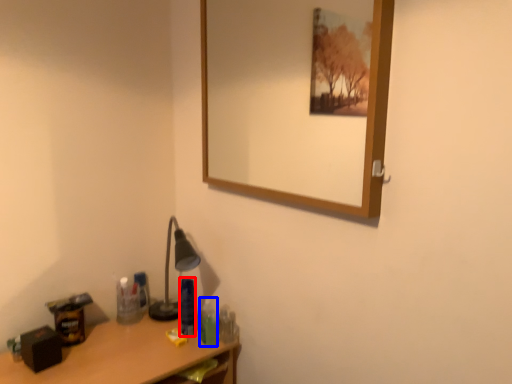
Question: Which point is closer to the camera, toiletry (highlighted by a red box) or toiletry (highlighted by a blue box)?

Choices:
 (A) toiletry
 (B) toiletry

Answer: (B)